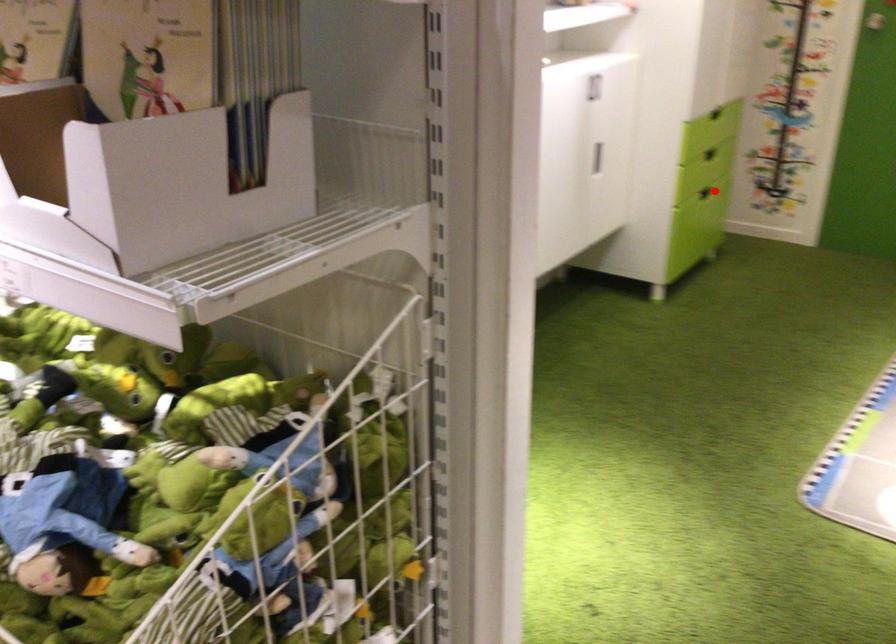
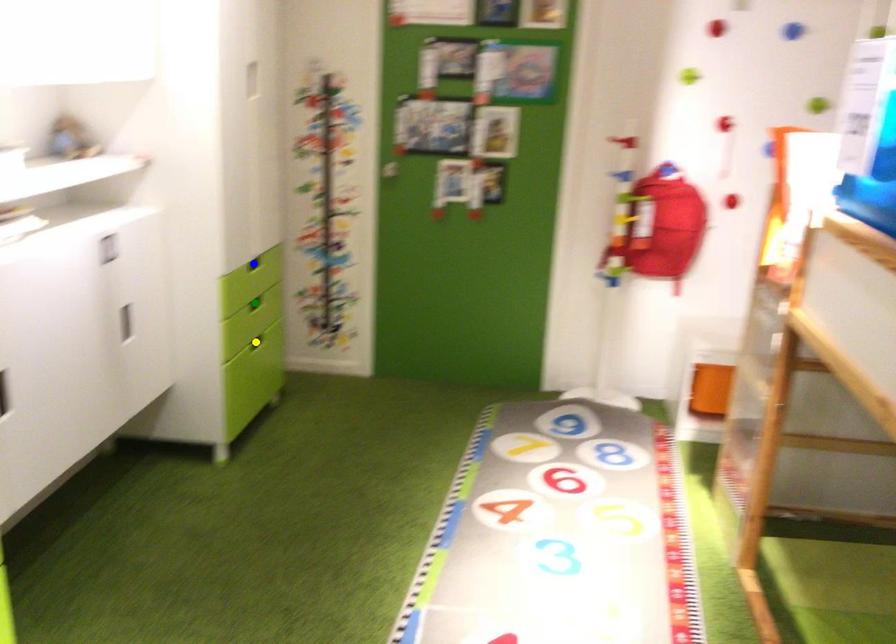
Question: I am providing you with two images of the same scene from different viewpoints. A red point is marked on the first image. You are given multiple points on the second image. Which spot in image 2 lines up with the point in image 1?

Choices:
 (A) yellow point
 (B) green point
 (C) blue point

Answer: (A)